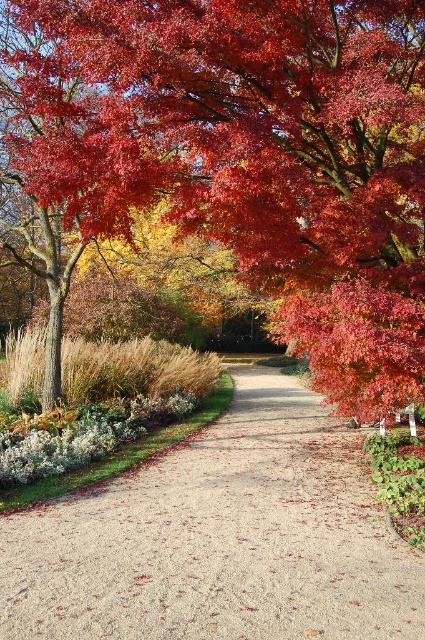
Can you confirm if gravel path at center is positioned below glossy red maple leaf at upper right?

Correct, gravel path at center is located below glossy red maple leaf at upper right.

Is point (266, 490) positioned in front of point (410, 400)?

No, it is behind (410, 400).

Who is more forward, (198,515) or (424,340)?

Positioned in front is point (198,515).

Find the location of `gravel path at center`. gravel path at center is located at coordinates (221, 538).

Can you confirm if shiny red maple tree at center is thinner than glossy red maple leaf at upper right?

Yes, shiny red maple tree at center is thinner than glossy red maple leaf at upper right.

Does point (90, 12) come in front of point (320, 305)?

Yes, it is.

You are a GUI agent. You are given a task and a screenshot of the screen. Output one action in this format:
    pyautogui.click(x=<x>, y=<y>)
    Task: Click on the shiny red maple tree at center
    The image size is (425, 640).
    Given the screenshot: What is the action you would take?
    pyautogui.click(x=255, y=154)

Can you confirm if shiny red maple tree at center is wider than gravel path at center?

No.

Does point (323, 61) lie behind point (346, 545)?

That is True.

You are a GUI agent. You are given a task and a screenshot of the screen. Output one action in this format:
    pyautogui.click(x=<x>, y=<y>)
    Task: Click on the shiny red maple tree at center
    
    Given the screenshot: What is the action you would take?
    pyautogui.click(x=255, y=154)